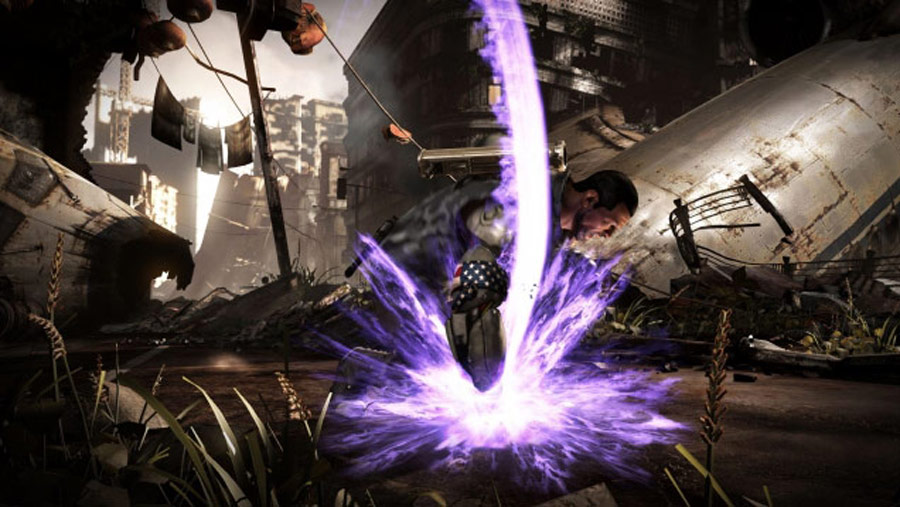
What are the coordinates of `purple light` in the screenshot? It's located at (536, 140).